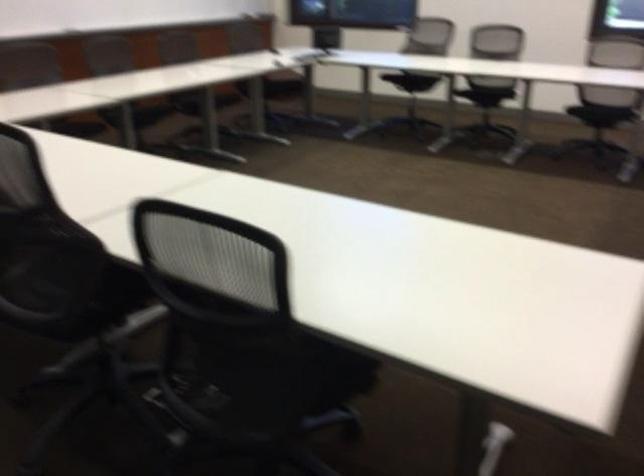
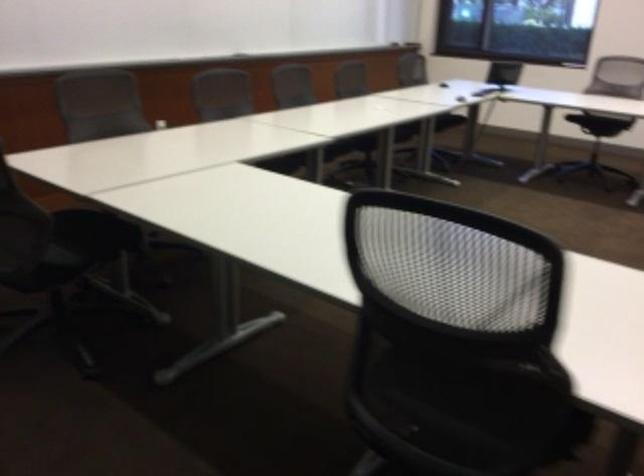
Which direction would the cameraman need to move to produce the second image?

The movement direction of the cameraman is left, forward.